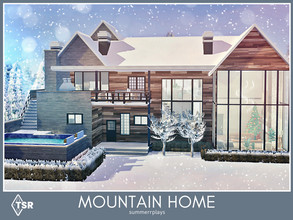
Locate an element on the screen. windows is located at coordinates (89, 80), (122, 121), (77, 118), (138, 120), (134, 84), (179, 90), (254, 95).